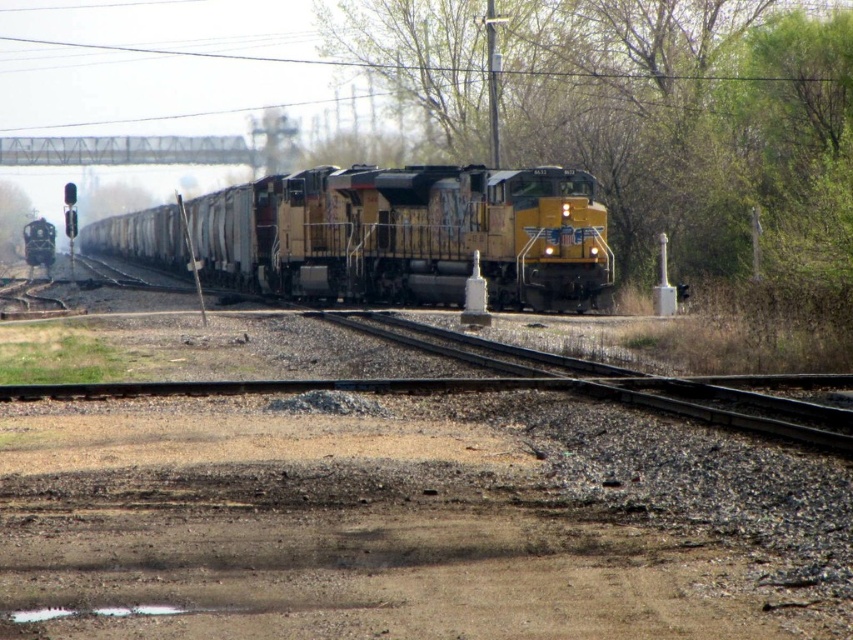
Question: Which point appears closest to the camera in this image?

Choices:
 (A) (373, 282)
 (B) (26, 212)

Answer: (A)

Question: Is green leafy tree at center behind green leafy tree at left?

Choices:
 (A) yes
 (B) no

Answer: (B)

Question: Which object is the closest to the yellow weathered locomotive at center?

Choices:
 (A) green leafy tree at center
 (B) green leafy tree at left

Answer: (A)

Question: Does yellow weathered locomotive at center have a larger size compared to green leafy tree at left?

Choices:
 (A) yes
 (B) no

Answer: (A)

Question: Estimate the real-world distances between objects in this image. Which object is closer to the green leafy tree at left?

Choices:
 (A) green leafy tree at center
 (B) yellow weathered locomotive at center

Answer: (B)

Question: Is yellow weathered locomotive at center bigger than green leafy tree at left?

Choices:
 (A) no
 (B) yes

Answer: (B)